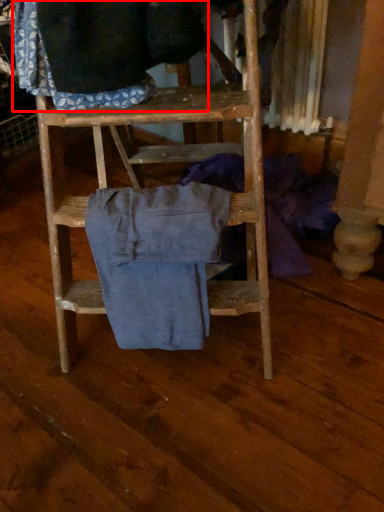
Question: Considering the relative positions of clothing (annotated by the red box) and clothing in the image provided, where is clothing (annotated by the red box) located with respect to the staircase?

Choices:
 (A) right
 (B) left

Answer: (B)